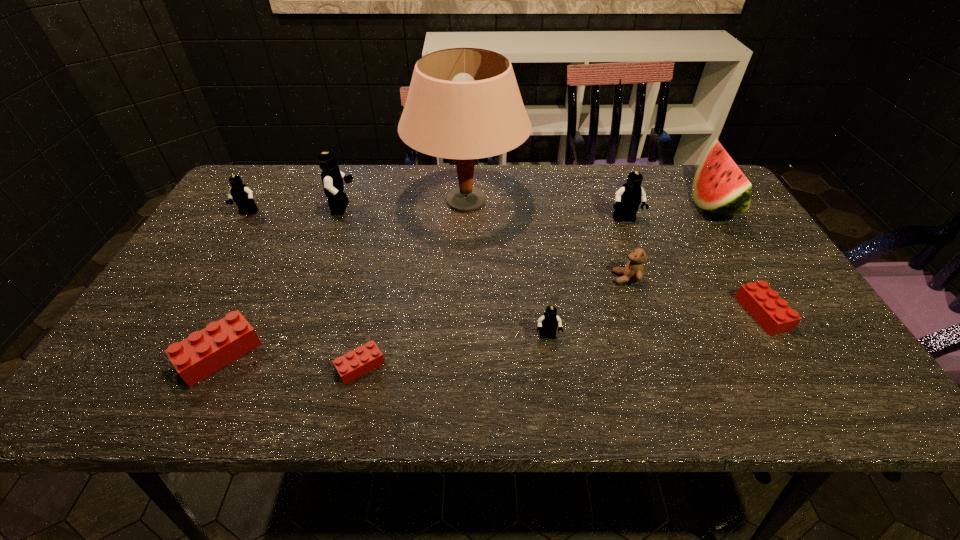
Identify the location of vacant region at the far edge. Image resolution: width=960 pixels, height=540 pixels. (366, 198).

The width and height of the screenshot is (960, 540). What are the coordinates of `blank area at the near edge` in the screenshot? It's located at (308, 392).

The width and height of the screenshot is (960, 540). In the image, there is a desktop. Identify the location of vacant space at the left edge. (229, 232).

Find the location of a particular element. This screenshot has width=960, height=540. vacant space at the right edge is located at coordinates (808, 309).

Find the location of a particular element. This screenshot has height=540, width=960. free space at the far left corner of the desktop is located at coordinates coord(275,165).

Where is `vacant area that lies between the lampshade and the second shortest Lego`? vacant area that lies between the lampshade and the second shortest Lego is located at coordinates (614, 258).

You are a GUI agent. You are given a task and a screenshot of the screen. Output one action in this format:
    pyautogui.click(x=<x>, y=<y>)
    Task: Click on the free space between the rightmost Lego and the green watermelon
    This screenshot has height=540, width=960.
    Given the screenshot: What is the action you would take?
    pyautogui.click(x=737, y=259)

The image size is (960, 540). I want to click on free spot between the sixth Lego from right to left and the fourth Lego from right to left, so click(x=290, y=360).

Identify the location of vacant area that lies between the leftmost red Lego and the teddy bear. This screenshot has width=960, height=540. (423, 316).

This screenshot has width=960, height=540. I want to click on free area in between the fifth shortest Lego and the teddy bear, so click(x=437, y=246).